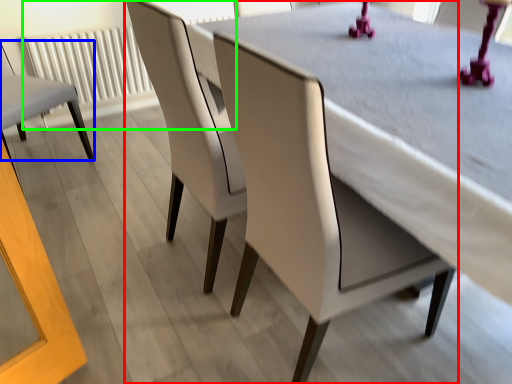
Question: Which object is the closest to the chair (highlighted by a red box)? Choose among these: chair (highlighted by a blue box) or radiator (highlighted by a green box).

Choices:
 (A) chair
 (B) radiator

Answer: (A)